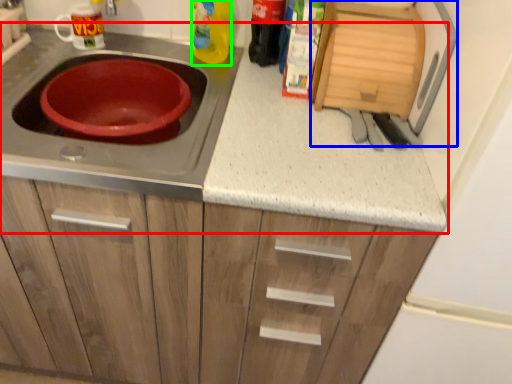
Question: Which object is the closest to the countertop (highlighted by a red box)? Choose among these: appliance (highlighted by a blue box) or bottle (highlighted by a green box).

Choices:
 (A) appliance
 (B) bottle

Answer: (A)